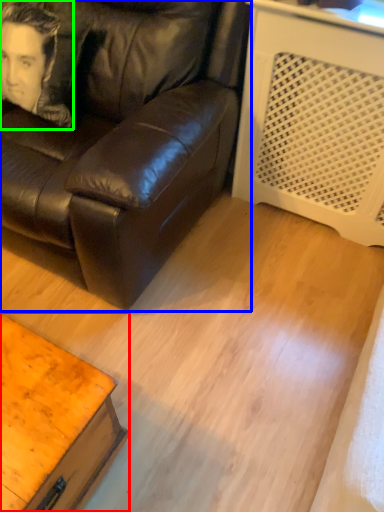
Question: Based on their relative distances, which object is nearer to table (highlighted by a red box)? Choose from studio couch (highlighted by a blue box) and man (highlighted by a green box).

Choices:
 (A) studio couch
 (B) man

Answer: (A)